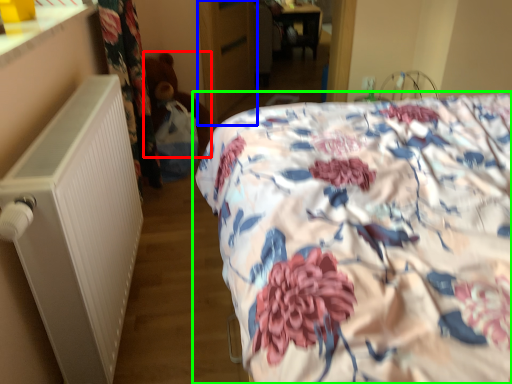
Question: Based on their relative distances, which object is nearer to teddy (highlighted by a red box)? Choose from armoire (highlighted by a blue box) and bed (highlighted by a green box).

Choices:
 (A) armoire
 (B) bed

Answer: (A)